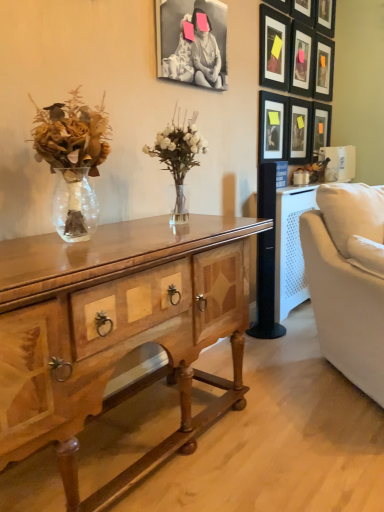
Find the location of a particular element. vacant area on top of wooden desk at center (from a real-world perspective) is located at coordinates (104, 238).